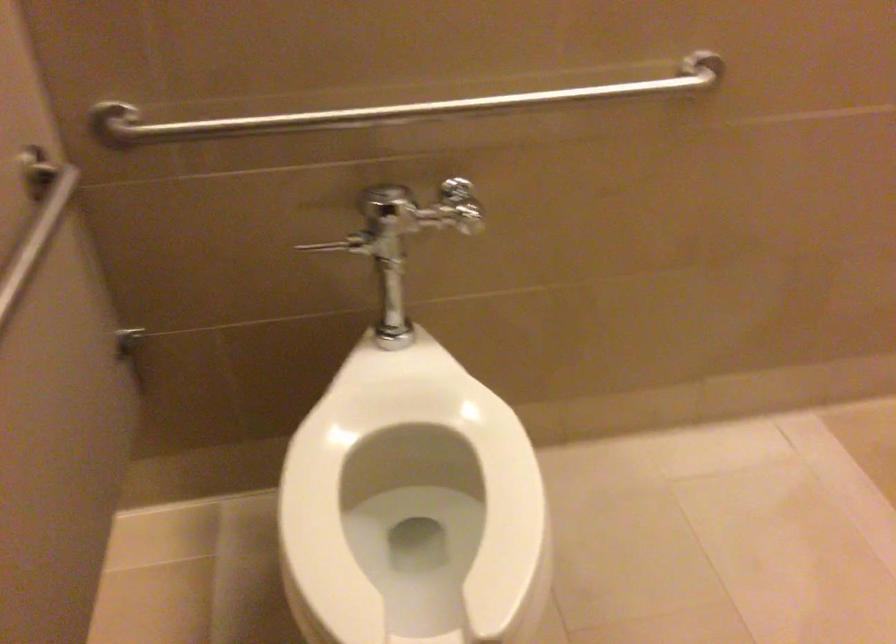
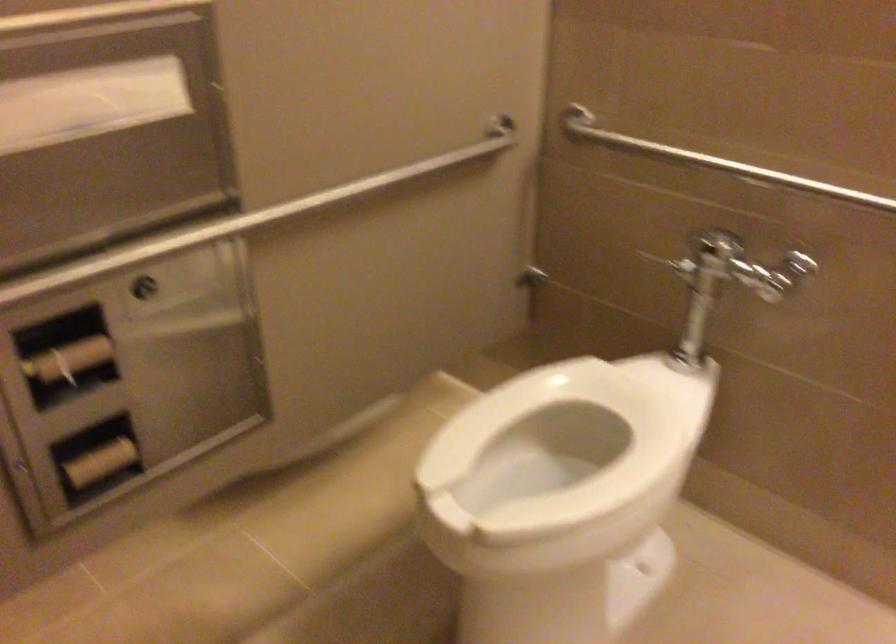
Where in the second image is the point corresponding to point (349, 114) from the first image?

(716, 162)